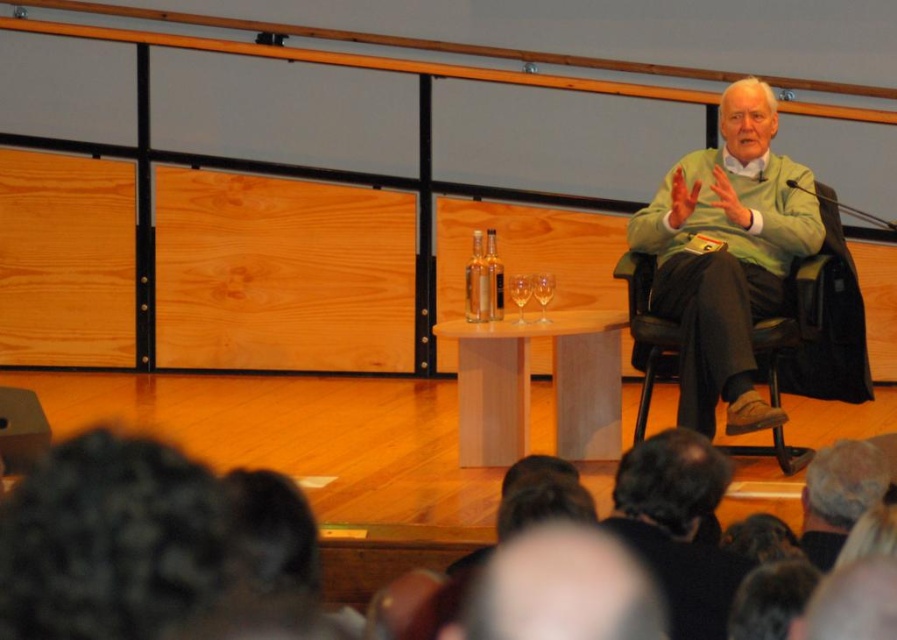
Is clear glass wine glass at center smaller than transparent glass at center?

Result: Yes, clear glass wine glass at center is smaller than transparent glass at center.

Who is shorter, clear glass wine glass at center or transparent glass at center?

Standing shorter between the two is clear glass wine glass at center.

The width and height of the screenshot is (897, 640). What do you see at coordinates (519, 292) in the screenshot? I see `clear glass wine glass at center` at bounding box center [519, 292].

The height and width of the screenshot is (640, 897). What are the coordinates of `clear glass wine glass at center` in the screenshot? It's located at (519, 292).

Does brown leather jacket at lower right appear on the left side of transparent glass at center?

In fact, brown leather jacket at lower right is to the right of transparent glass at center.

Which is behind, point (861, 460) or point (552, 276)?

The point (552, 276) is more distant.

Locate an element on the screen. The width and height of the screenshot is (897, 640). brown leather jacket at lower right is located at coordinates tap(840, 493).

Is dark brown hair at lower center positioned at the back of clear glass wine glass at center?

That is False.

What are the coordinates of `dark brown hair at lower center` in the screenshot? It's located at (678, 525).

Find the location of `dark brown hair at lower center`. dark brown hair at lower center is located at coordinates (678, 525).